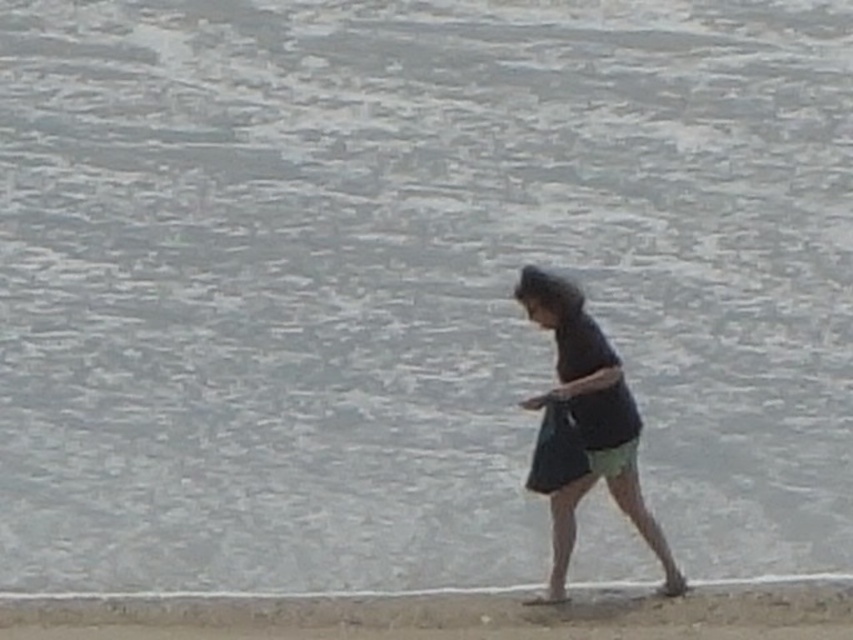
Question: Which point is closer to the camera?

Choices:
 (A) sandy beach at lower center
 (B) dark matte shirt at center

Answer: (A)

Question: Can you confirm if sandy beach at lower center is wider than dark matte shirt at center?

Choices:
 (A) no
 (B) yes

Answer: (B)

Question: Which object appears closest to the camera in this image?

Choices:
 (A) sandy beach at lower center
 (B) dark matte shirt at center

Answer: (A)

Question: Is sandy beach at lower center positioned in front of dark matte shirt at center?

Choices:
 (A) no
 (B) yes

Answer: (B)

Question: Does sandy beach at lower center have a lesser width compared to dark matte shirt at center?

Choices:
 (A) no
 (B) yes

Answer: (A)